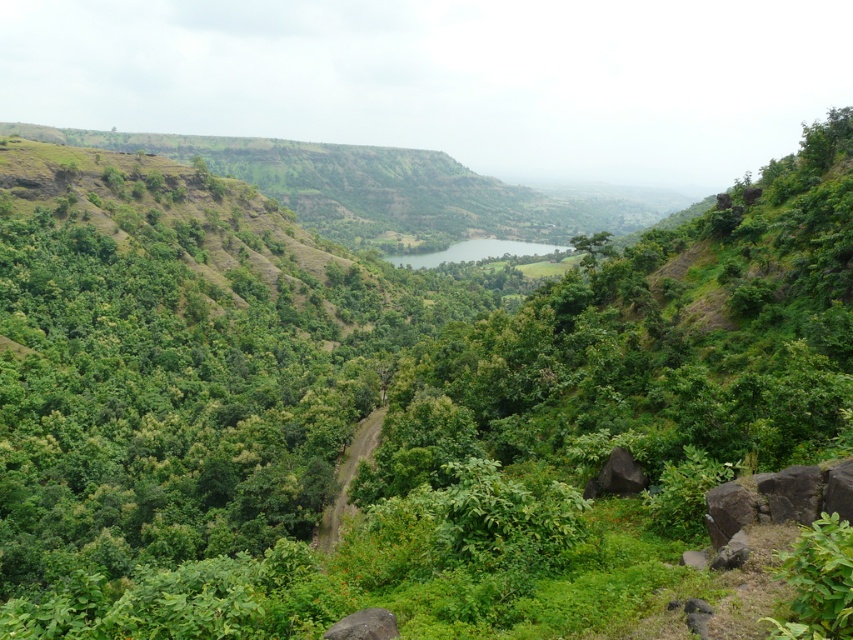
In the scene shown: You are a hiker trying to cross the valley. You see the green smooth lake at center and the gray rock at lower center. Which object is larger in size?

The green smooth lake at center is bigger than the gray rock at lower center, so the green smooth lake at center is larger in size.